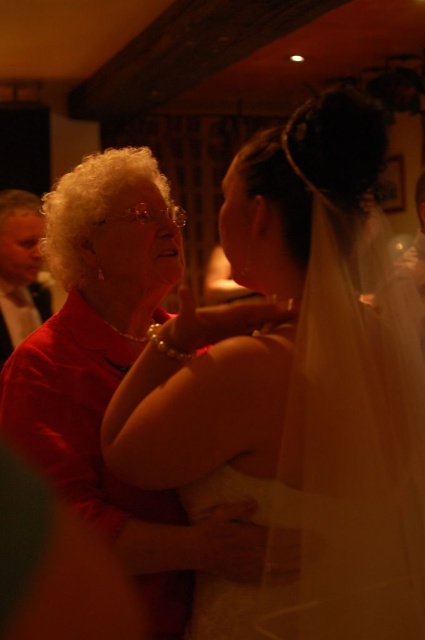
Question: Among these objects, which one is nearest to the camera?

Choices:
 (A) matte red shirt at left
 (B) white satin dress at center

Answer: (B)

Question: Does white satin dress at center appear on the right side of matte red shirt at left?

Choices:
 (A) no
 (B) yes

Answer: (B)

Question: Is white satin dress at center positioned at the back of matte red shirt at left?

Choices:
 (A) yes
 (B) no

Answer: (B)

Question: Does white satin dress at center appear on the right side of matte red shirt at left?

Choices:
 (A) yes
 (B) no

Answer: (A)

Question: Which object appears closest to the camera in this image?

Choices:
 (A) matte red shirt at left
 (B) white satin dress at center

Answer: (B)